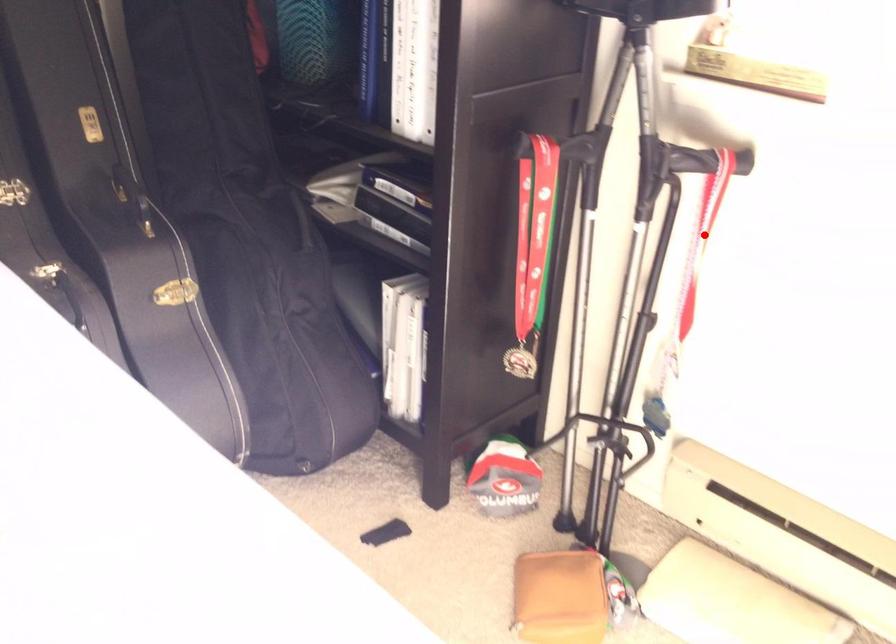
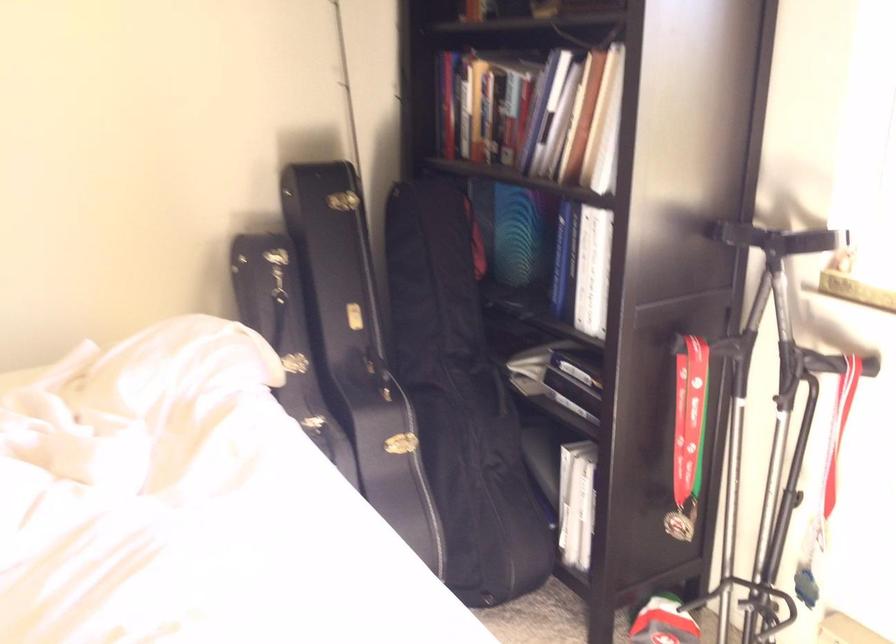
Question: A red point is marked in image1. In image2, is the corresponding 3D point closer to the camera or farther? Reply with the corresponding letter.

Choices:
 (A) The corresponding 3D point is closer.
 (B) The corresponding 3D point is farther.

Answer: (B)